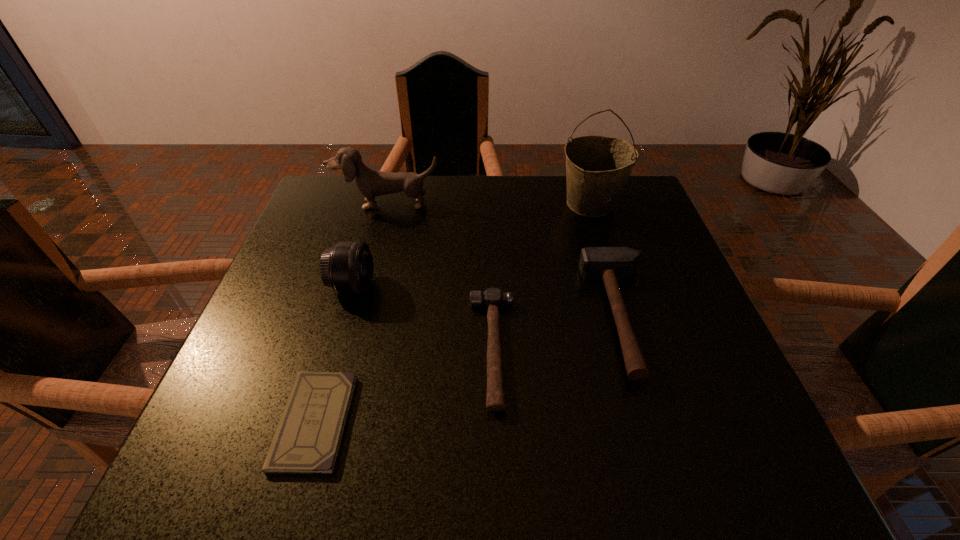
I want to click on vacant area located 0.340m on the front-facing side of the telephoto lens, so click(529, 286).

The height and width of the screenshot is (540, 960). I want to click on vacant space located 0.340m on the striking surface of the third shortest object, so click(424, 316).

Locate an element on the screen. This screenshot has width=960, height=540. free point located 0.330m on the striking surface of the third shortest object is located at coordinates (429, 316).

The image size is (960, 540). Identify the location of vacant area situated on the striking surface of the third shortest object. (399, 316).

You are a GUI agent. You are given a task and a screenshot of the screen. Output one action in this format:
    pyautogui.click(x=<x>, y=<y>)
    Task: Click on the free space located on the striking face of the left hammer
    This screenshot has height=540, width=960.
    Given the screenshot: What is the action you would take?
    coord(433,349)

Where is `free region located on the striking face of the left hammer`? The image size is (960, 540). free region located on the striking face of the left hammer is located at coordinates (324, 349).

In order to click on free location located on the striking face of the left hammer in this screenshot , I will do `click(276, 349)`.

At what (x,y) coordinates should I click in order to perform the action: click on vacant space situated 0.130m on the right of the checkbook. Please return your answer as a coordinate pair (x, y). This screenshot has height=540, width=960. Looking at the image, I should click on (425, 421).

Locate an element on the screen. The height and width of the screenshot is (540, 960). wine bucket positioned at the far edge is located at coordinates (597, 167).

Image resolution: width=960 pixels, height=540 pixels. Find the location of `puppy positioned at the far edge`. puppy positioned at the far edge is located at coordinates (371, 183).